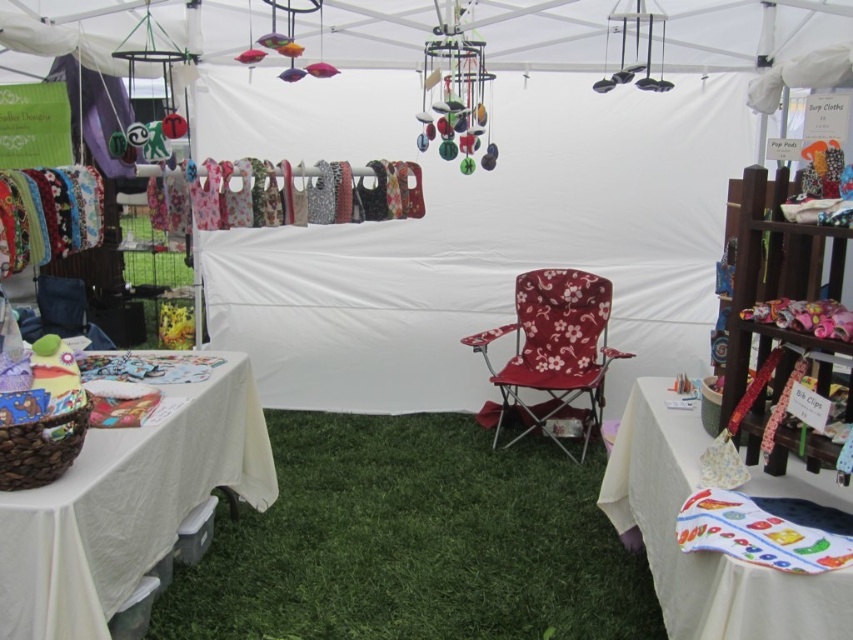
Question: Can you confirm if green artificial turf at center is positioned above floral fabric folding chair at center?

Choices:
 (A) yes
 (B) no

Answer: (B)

Question: Does white fabric table at lower left come in front of printed fabric tablecloth at center?

Choices:
 (A) yes
 (B) no

Answer: (B)

Question: Among these points, which one is farthest from the camera?

Choices:
 (A) (503, 465)
 (B) (103, 460)
 (C) (715, 620)
 (D) (601, 352)

Answer: (D)

Question: Among these objects, which one is nearest to the camera?

Choices:
 (A) floral fabric folding chair at center
 (B) printed fabric tablecloth at center

Answer: (B)

Question: Does green artificial turf at center appear under white fabric table at lower left?

Choices:
 (A) yes
 (B) no

Answer: (A)

Question: Which object is the farthest from the printed fabric tablecloth at center?

Choices:
 (A) floral fabric folding chair at center
 (B) white fabric table at lower left

Answer: (B)